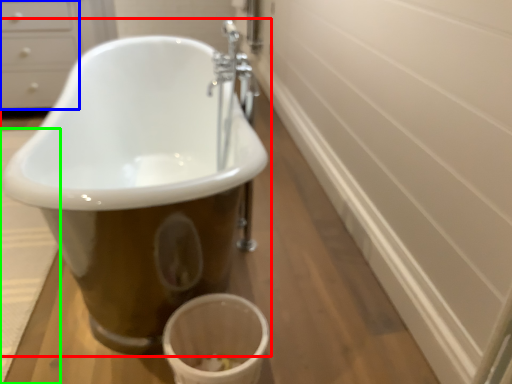
Question: Which object is the closest to the bathtub (highlighted by a red box)? Choose among these: drawer (highlighted by a blue box) or bath mat (highlighted by a green box).

Choices:
 (A) drawer
 (B) bath mat

Answer: (B)